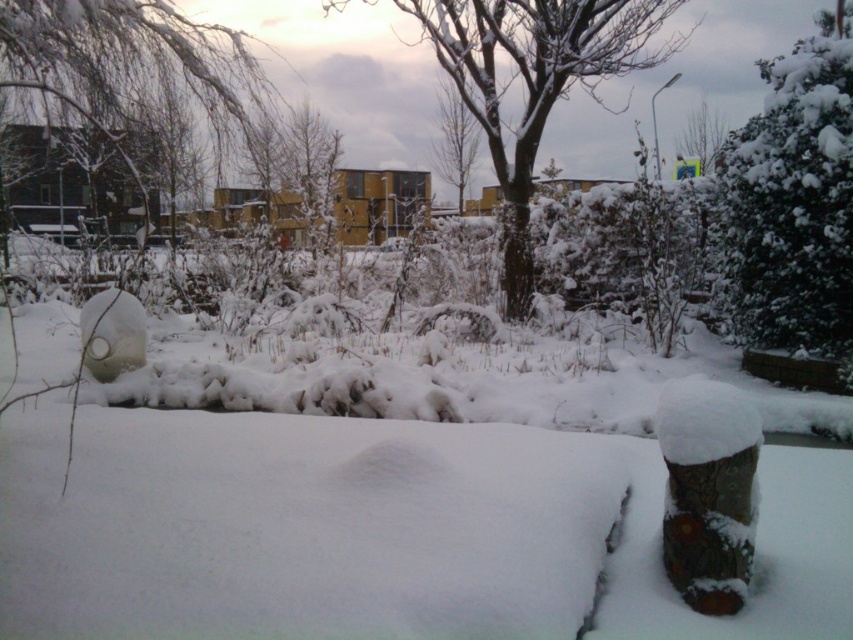
Question: Among these objects, which one is nearest to the camera?

Choices:
 (A) white fluffy bush at upper right
 (B) snow-covered tree at center

Answer: (A)

Question: Estimate the real-world distances between objects in this image. Which object is farther from the snow-covered tree at center?

Choices:
 (A) white fluffy bush at upper right
 (B) bare branches at center

Answer: (A)

Question: Is snow-covered tree at center behind bare branches at center?

Choices:
 (A) no
 (B) yes

Answer: (A)

Question: Which point appears closest to the camera in this image?

Choices:
 (A) (843, 58)
 (B) (471, 49)
 (C) (712, 140)
 (D) (476, 124)

Answer: (A)

Question: Can you confirm if snow-covered tree at center is thinner than smooth bark tree at upper center?

Choices:
 (A) yes
 (B) no

Answer: (B)

Question: Where is bare branches at center located in relation to smooth bark tree at upper center in the image?

Choices:
 (A) left
 (B) right

Answer: (A)